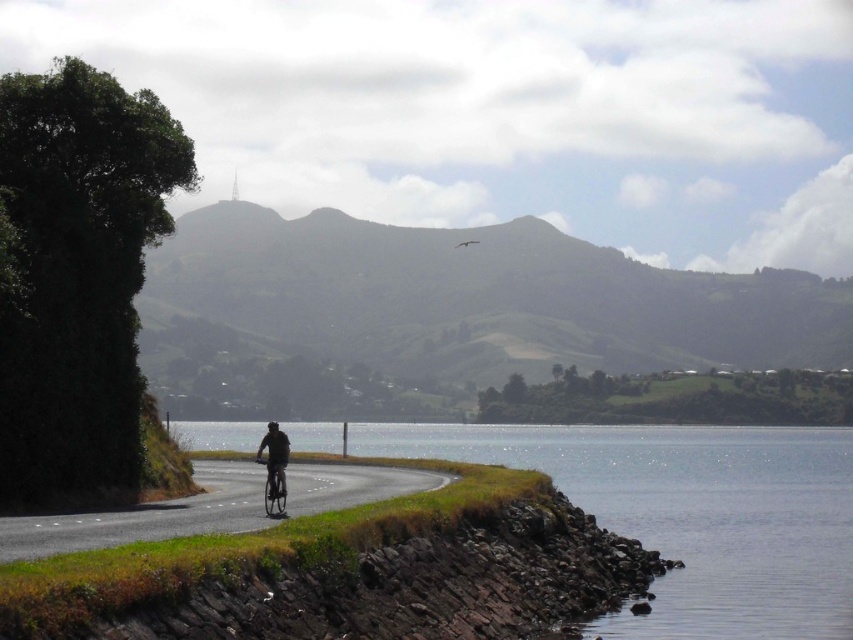
Is black asphalt road at center to the right of metallic silver bicycle at center from the viewer's perspective?

Incorrect, black asphalt road at center is not on the right side of metallic silver bicycle at center.

Between point (357, 484) and point (281, 484), which one is positioned in front?

Point (281, 484)

Find the location of a particular element. black asphalt road at center is located at coordinates (146, 516).

Find the location of a particular element. The height and width of the screenshot is (640, 853). clear water at lower right is located at coordinates (689, 515).

Who is more distant from viewer, (824,524) or (271,500)?

Point (824,524)

Is point (828, 588) farther from camera compared to point (271, 508)?

Yes, point (828, 588) is behind point (271, 508).

You are a GUI agent. You are given a task and a screenshot of the screen. Output one action in this format:
    pyautogui.click(x=<x>, y=<y>)
    Task: Click on the clear water at lower right
    
    Given the screenshot: What is the action you would take?
    pyautogui.click(x=689, y=515)

Can you confirm if clear water at lower right is positioned above black asphalt road at center?

No.

Does clear water at lower right appear under black asphalt road at center?

Yes, clear water at lower right is below black asphalt road at center.

Which is in front, point (772, 454) or point (346, 486)?

Positioned in front is point (346, 486).

Locate an element on the screen. Image resolution: width=853 pixels, height=640 pixels. clear water at lower right is located at coordinates (689, 515).